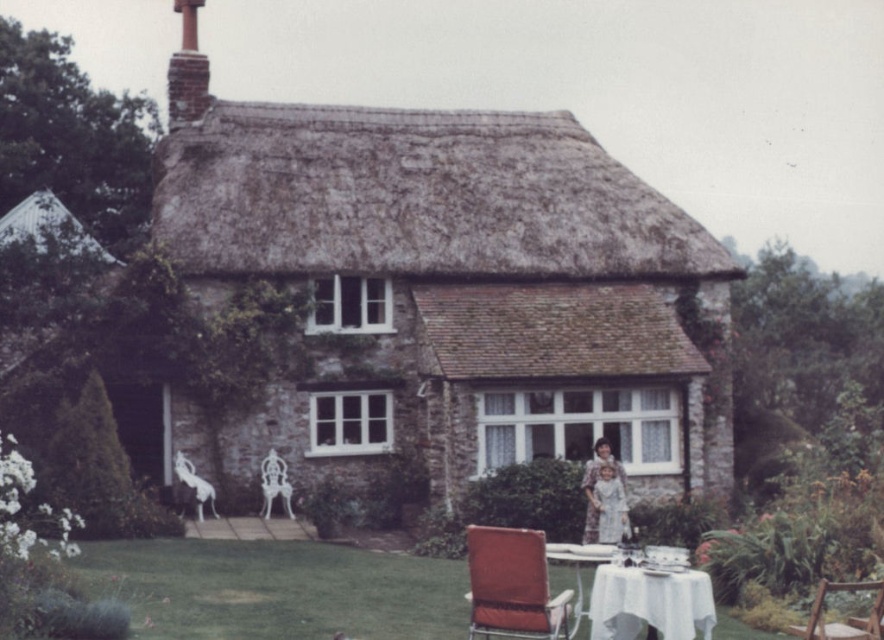
Is point (580, 582) closer to viewer compared to point (599, 467)?

That is True.

Between white cloth-covered table at lower center and floral fabric dress at center, which one has more height?

floral fabric dress at center is taller.

Image resolution: width=884 pixels, height=640 pixels. In order to click on white cloth-covered table at lower center in this screenshot , I will do `click(578, 566)`.

Can you confirm if matte orange chair at lower center is taller than wooden chair at center?

In fact, matte orange chair at lower center may be shorter than wooden chair at center.

This screenshot has width=884, height=640. I want to click on matte orange chair at lower center, so click(512, 586).

Can you confirm if green grass at lower center is wider than white cloth-covered table at lower right?

Yes, green grass at lower center is wider than white cloth-covered table at lower right.

Is green grass at lower center shorter than white cloth-covered table at lower right?

Indeed, green grass at lower center has a lesser height compared to white cloth-covered table at lower right.

Image resolution: width=884 pixels, height=640 pixels. What do you see at coordinates (273, 589) in the screenshot?
I see `green grass at lower center` at bounding box center [273, 589].

You are a GUI agent. You are given a task and a screenshot of the screen. Output one action in this format:
    pyautogui.click(x=<x>, y=<y>)
    Task: Click on the green grass at lower center
    The height and width of the screenshot is (640, 884).
    Given the screenshot: What is the action you would take?
    [x=273, y=589]